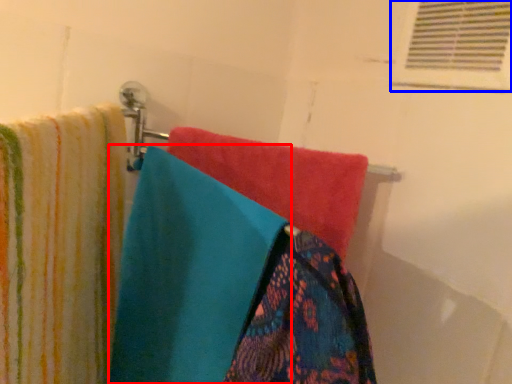
Question: Which object is closer to the camera taking this photo, towel (highlighted by a red box) or shutter (highlighted by a blue box)?

Choices:
 (A) towel
 (B) shutter

Answer: (A)